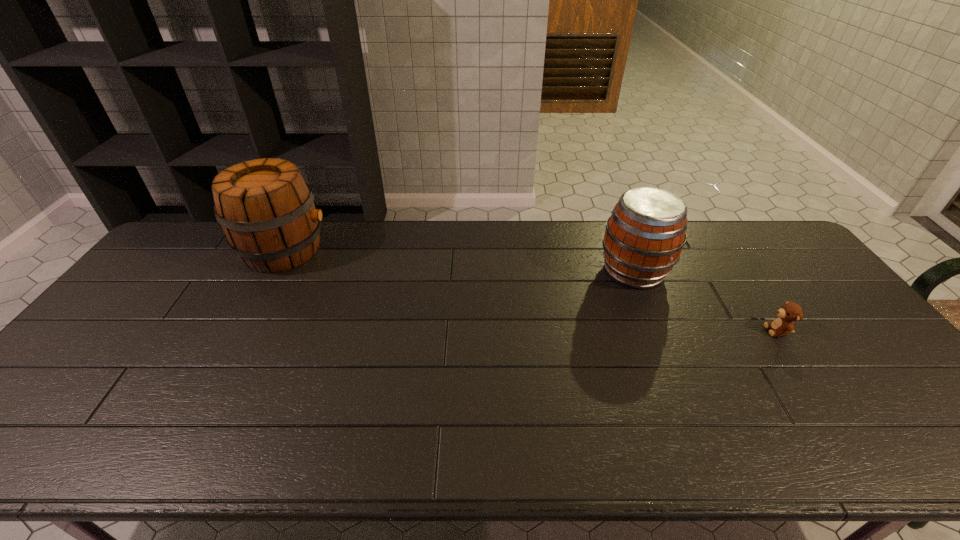
At what (x,y) coordinates should I click in order to perform the action: click on vacant area that lies between the left cider and the second object from right to left. Please return your answer as a coordinate pair (x, y). Image resolution: width=960 pixels, height=540 pixels. Looking at the image, I should click on (459, 261).

Find the location of `free point between the leftmost object and the right cider`. free point between the leftmost object and the right cider is located at coordinates tap(459, 261).

Where is `vacant space that's between the leftmost object and the nearest object`? The width and height of the screenshot is (960, 540). vacant space that's between the leftmost object and the nearest object is located at coordinates (531, 291).

The height and width of the screenshot is (540, 960). Identify the location of object that stands as the closest to the leftmost object. (644, 236).

Choose which object is the second nearest neighbor to the shortest object. Please provide its 2D coordinates. Your answer should be formatted as a tuple, i.e. [(x, y)], where the tuple contains the x and y coordinates of a point satisfying the conditions above.

[(266, 209)]

Locate an element on the screen. The image size is (960, 540). blank space that satisfies the following two spatial constraints: 1. on the side of the leftmost object where the spigot is located; 2. on the left side of the second object from left to right is located at coordinates (274, 271).

Find the location of a particular element. free space that satisfies the following two spatial constraints: 1. on the side of the right cider where the spigot is located; 2. on the right side of the leftmost object is located at coordinates (274, 271).

This screenshot has height=540, width=960. I want to click on vacant space that satisfies the following two spatial constraints: 1. on the side of the leftmost object where the spigot is located; 2. on the left side of the second object from left to right, so click(x=274, y=271).